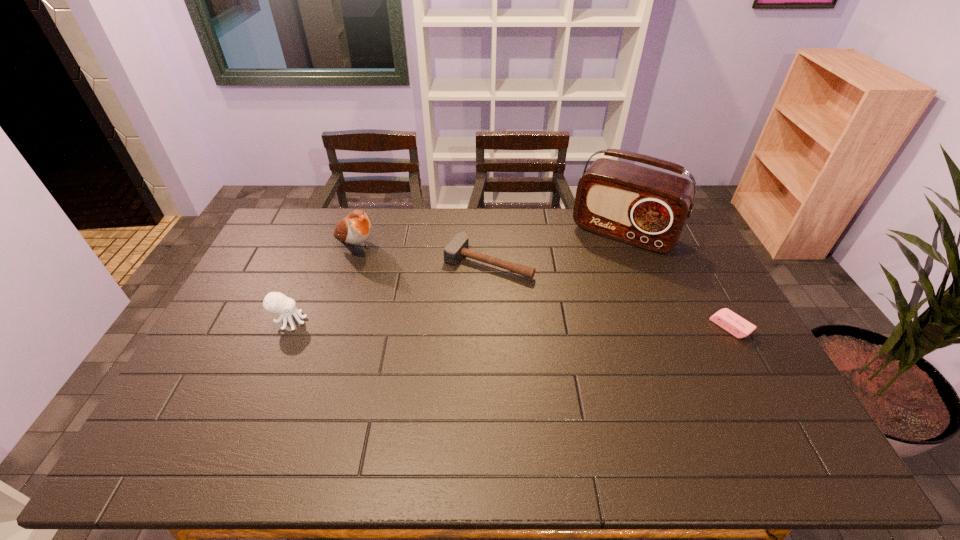
What are the coordinates of `free space between the radio receiver and the octopus` in the screenshot? It's located at (457, 277).

Locate an element on the screen. The image size is (960, 540). empty location between the third tallest object and the fourth tallest object is located at coordinates (389, 292).

The height and width of the screenshot is (540, 960). What are the coordinates of `vacant space that's between the hammer and the shortest object` in the screenshot? It's located at (610, 294).

At what (x,y) coordinates should I click in order to perform the action: click on free spot between the third object from right to left and the bird. Please return your answer as a coordinate pair (x, y). This screenshot has width=960, height=540. Looking at the image, I should click on (422, 254).

The image size is (960, 540). What are the coordinates of `free spot between the shortest object and the second tallest object` in the screenshot? It's located at point(543,287).

Where is `vacant space in between the third object from right to left and the radio receiver`? vacant space in between the third object from right to left and the radio receiver is located at coordinates (556, 247).

The width and height of the screenshot is (960, 540). I want to click on vacant space that's between the bird and the radio receiver, so click(x=490, y=240).

Identify the location of empty location between the eraser and the radio receiver. The width and height of the screenshot is (960, 540). (677, 280).

Locate which object is the fourth closest to the eraser. Please provide its 2D coordinates. Your answer should be formatted as a tuple, i.e. [(x, y)], where the tuple contains the x and y coordinates of a point satisfying the conditions above.

[(275, 302)]

The height and width of the screenshot is (540, 960). What are the coordinates of `object that ranks as the closest to the shortest object` in the screenshot? It's located at (647, 208).